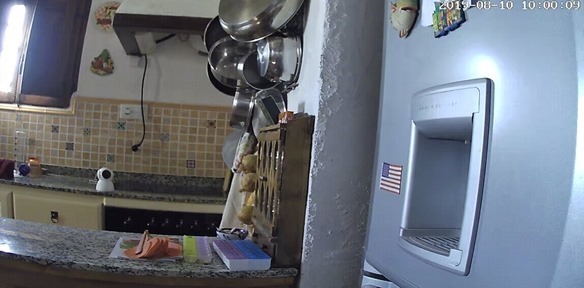
I want to click on wall decorations, so coord(104,68), coord(100,17).